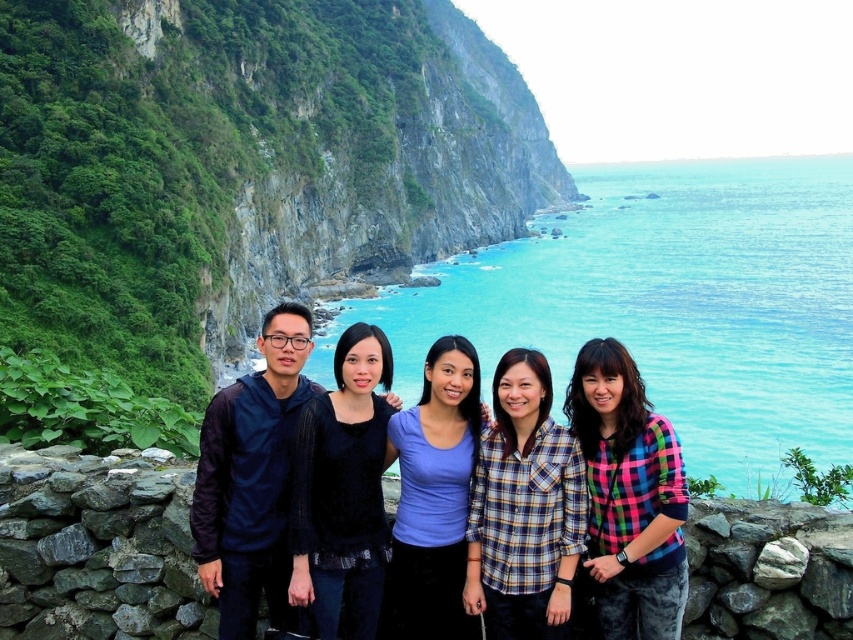
You are a photographer trying to capture the group of five individuals in the image. To ensure the green rock cliff at upper left is not blocking the group, where should you position the camera relative to the cliff?

The green rock cliff at upper left is located at point (241, 164), so you should position the camera to the right of the cliff to avoid it blocking the group.

What is the exact location of the green rock cliff at upper left in the image?

The green rock cliff at upper left is located at point coordinates [241,164].